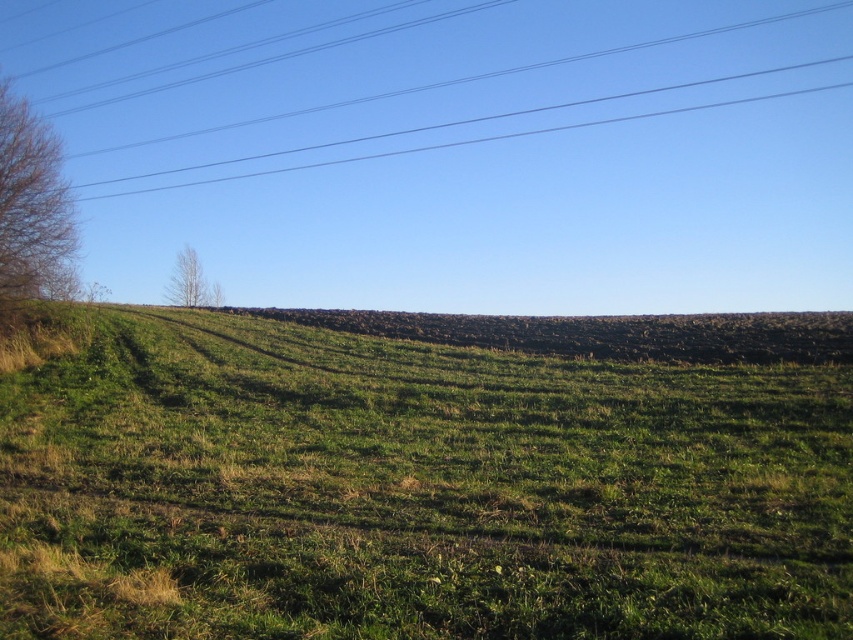
Question: Among these objects, which one is farthest from the camera?

Choices:
 (A) metallic wires at upper center
 (B) green leafy tree at upper left

Answer: (A)

Question: Does bare branches at left come behind green leafy tree at upper left?

Choices:
 (A) no
 (B) yes

Answer: (A)

Question: Can you confirm if green grassy field at center is positioned to the left of bare branches at left?

Choices:
 (A) yes
 (B) no

Answer: (B)

Question: Does metallic wires at upper center appear under green leafy tree at upper left?

Choices:
 (A) yes
 (B) no

Answer: (B)

Question: Which object is closer to the camera taking this photo?

Choices:
 (A) metallic wires at upper center
 (B) bare branches at left
 (C) green leafy tree at upper left

Answer: (B)

Question: Which object is closer to the camera taking this photo?

Choices:
 (A) green leafy tree at upper left
 (B) green grassy field at center

Answer: (B)